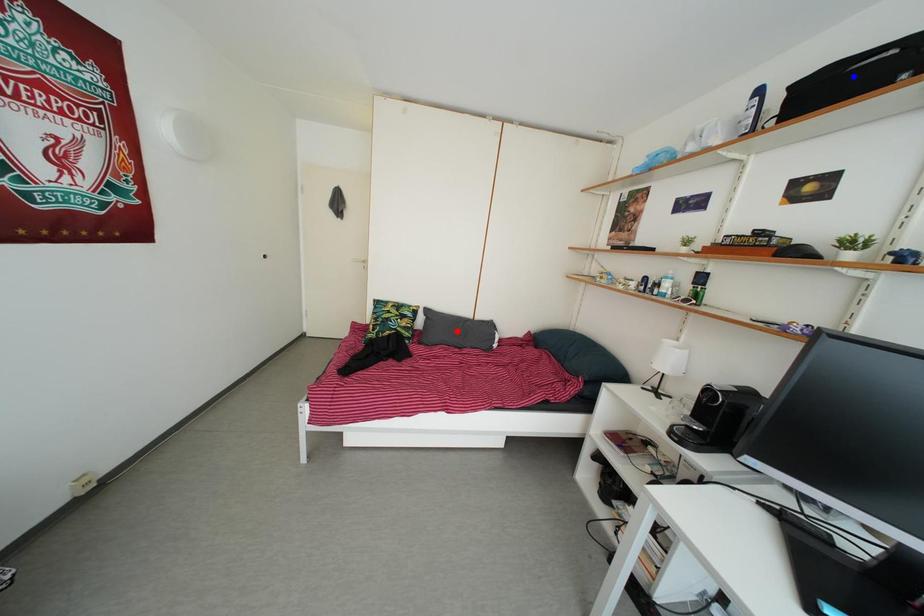
Question: Which of the two points in the image is closer to the camera?

Choices:
 (A) Blue point is closer.
 (B) Red point is closer.

Answer: (A)